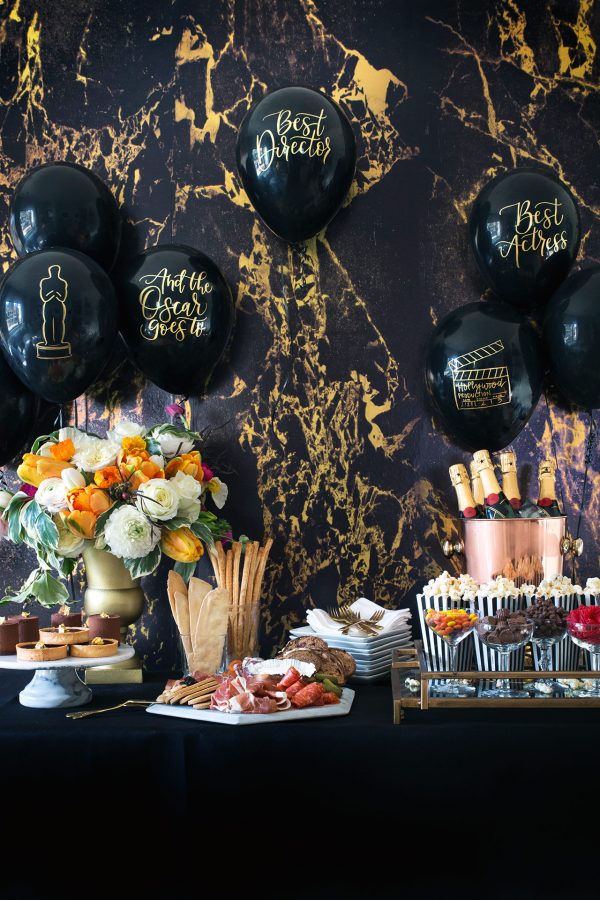
Locate an element on the screen. The height and width of the screenshot is (900, 600). wine bottle is located at coordinates (464, 495), (477, 482), (484, 480), (507, 480), (550, 490).